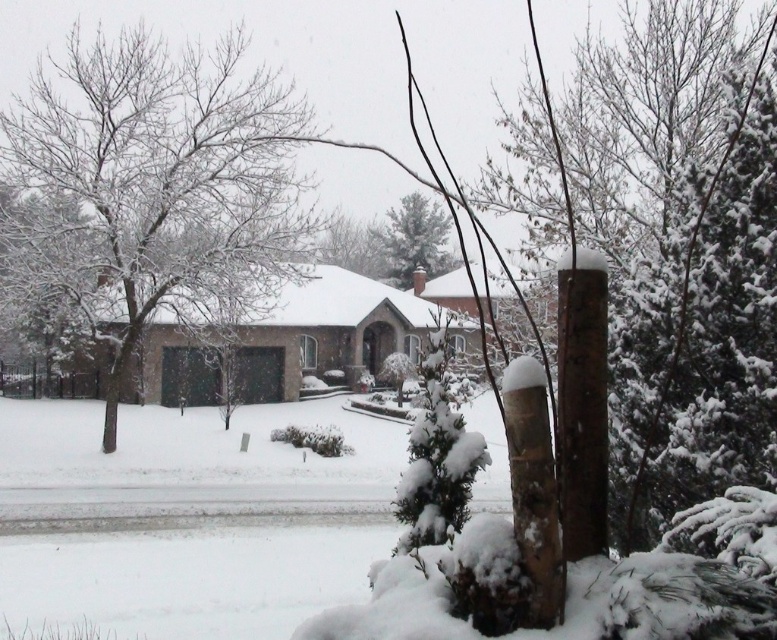
Does brown rough wood pole at right appear over white fluffy snow at center?

No, brown rough wood pole at right is not above white fluffy snow at center.

Does brown rough wood pole at right lie behind white fluffy snow at center?

No, brown rough wood pole at right is in front of white fluffy snow at center.

The image size is (777, 640). I want to click on brown rough wood pole at right, so click(580, 404).

Between point (79, 220) and point (744, 452), which one is positioned in front?

Point (744, 452) is in front.

Who is shorter, snow-covered tree at left or snow-covered evergreen at center-right?

Standing shorter between the two is snow-covered evergreen at center-right.

Between point (183, 134) and point (744, 337), which one is positioned in front?

Point (744, 337) is more forward.

Locate an element on the screen. This screenshot has width=777, height=640. snow-covered tree at left is located at coordinates (152, 186).

Is snow-covered tree at left shorter than green textured pine tree at center?

No, snow-covered tree at left is not shorter than green textured pine tree at center.

Which is behind, point (186, 108) or point (420, 262)?

The point (420, 262) is more distant.

Identify the location of snow-covered tree at left. (152, 186).